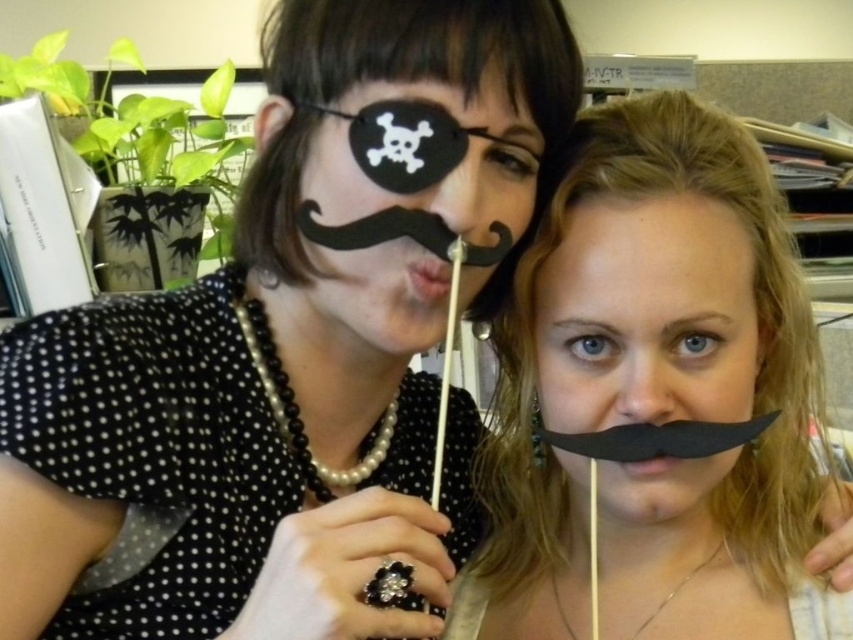
You are standing in the office scene and want to touch both points mentioned. Which point should you reach for first, point [711,483] or point [436,292], if you want to touch the one closer to you first?

You should reach for point [711,483] first because it is closer to you than point [436,292].

You are a photographer standing in front of the scene. You want to take a closeup shot of the black paper mustache at upper center. The camera you are using has a minimum focusing distance of 50 centimeters. Can you take the photo without moving closer?

The distance between the black paper mustache at upper center and the viewer is 45.79 centimeters, which is less than the camera minimum focusing distance of 50 centimeters. Therefore, you cannot take the photo without moving back to ensure the mustache is within the camera focus range.